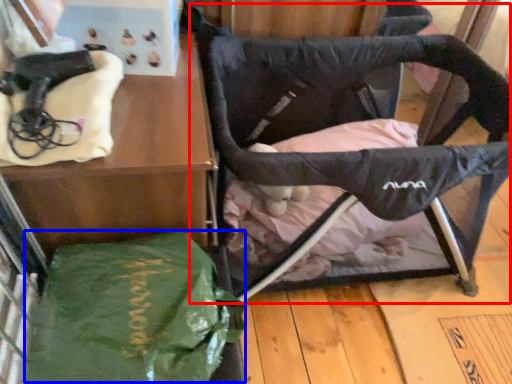
Question: Which object is closer to the camera taking this photo, swivel chair (highlighted by a red box) or tote bag (highlighted by a blue box)?

Choices:
 (A) swivel chair
 (B) tote bag

Answer: (B)